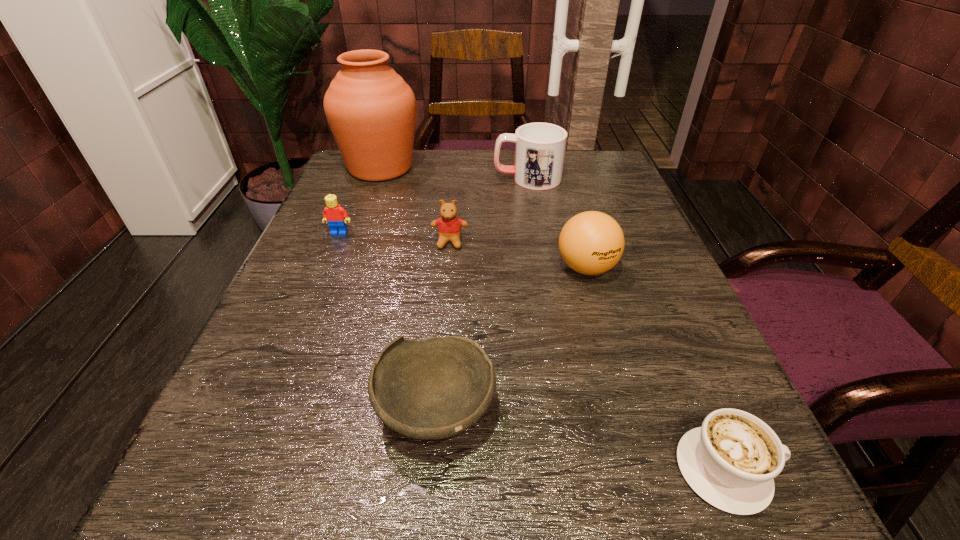
At what (x,y) coordinates should I click in order to perform the action: click on the tallest object. Please return your answer as a coordinate pair (x, y). The width and height of the screenshot is (960, 540). Looking at the image, I should click on (371, 111).

What are the coordinates of `mug` in the screenshot? It's located at (540, 148).

Identify the location of ping-pong ball. The width and height of the screenshot is (960, 540). (591, 243).

The image size is (960, 540). What are the coordinates of `Lego` in the screenshot? It's located at (336, 216).

At what (x,y) coordinates should I click in order to perform the action: click on teddy bear. Please return your answer as a coordinate pair (x, y). This screenshot has height=540, width=960. Looking at the image, I should click on (449, 226).

Locate an element on the screen. This screenshot has width=960, height=540. bowl is located at coordinates (x=431, y=389).

You are a GUI agent. You are given a task and a screenshot of the screen. Output one action in this format:
    pyautogui.click(x=<x>, y=<y>)
    Task: Click on the cappuccino
    
    Given the screenshot: What is the action you would take?
    pyautogui.click(x=731, y=461)

At what (x,y) coordinates should I click in order to perform the action: click on free space located 0.140m on the right of the urn. Please return your answer as a coordinate pair (x, y). Image resolution: width=960 pixels, height=540 pixels. Looking at the image, I should click on (478, 168).

The height and width of the screenshot is (540, 960). I want to click on vacant point located 0.280m on the side of the mug with the handle, so click(x=375, y=178).

Locate an element on the screen. This screenshot has width=960, height=540. vacant area located on the side of the mug with the handle is located at coordinates (468, 178).